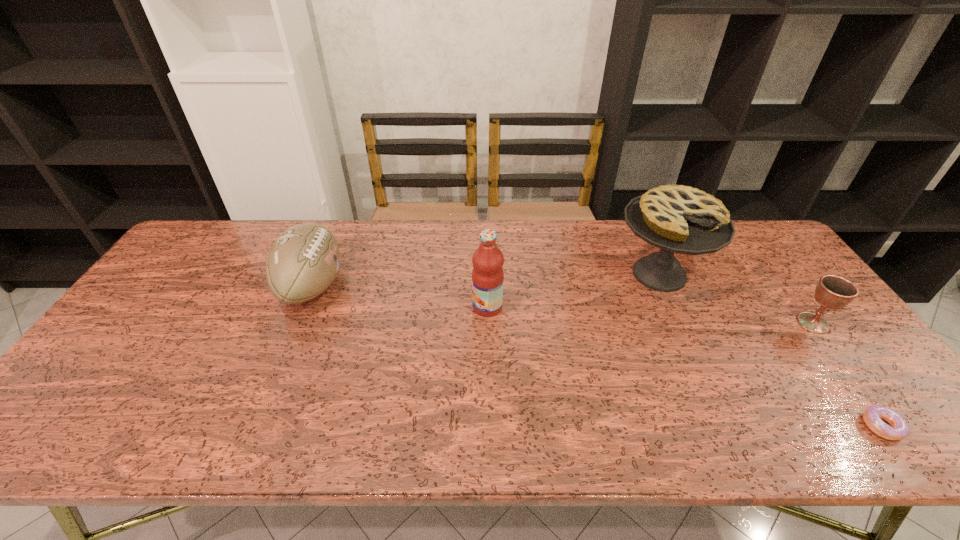
Find the location of a particular element. free space at the far edge of the desktop is located at coordinates (245, 244).

In the image, there is a desktop. In order to click on vacant space at the near edge in this screenshot , I will do point(357,436).

Find the location of `vacant space at the left edge`. vacant space at the left edge is located at coordinates (125, 347).

This screenshot has width=960, height=540. In the image, there is a desktop. In order to click on free space at the right edge in this screenshot , I will do `click(852, 370)`.

Find the location of a particular element. blank space at the far left corner of the desktop is located at coordinates (214, 229).

The width and height of the screenshot is (960, 540). I want to click on vacant area between the fourth tallest object and the fruit juice, so click(x=650, y=315).

You are a GUI agent. You are given a task and a screenshot of the screen. Output one action in this format:
    pyautogui.click(x=<x>, y=<y>)
    Task: Click on the free space between the shortest object and the pie
    The image size is (960, 540).
    Given the screenshot: What is the action you would take?
    pyautogui.click(x=770, y=350)

What are the coordinates of `vacant area that lies between the pie and the doughnut` in the screenshot? It's located at (770, 350).

Where is `free space between the fourth object from right to left and the shortest object`? free space between the fourth object from right to left and the shortest object is located at coordinates (684, 366).

Identify the location of free point between the football (American) and the nearest object. The width and height of the screenshot is (960, 540). (597, 356).